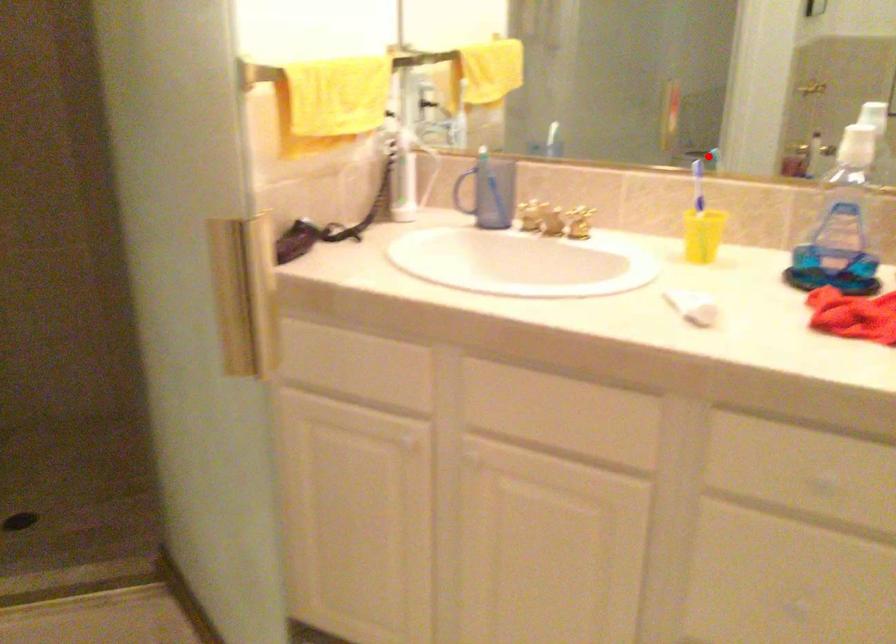
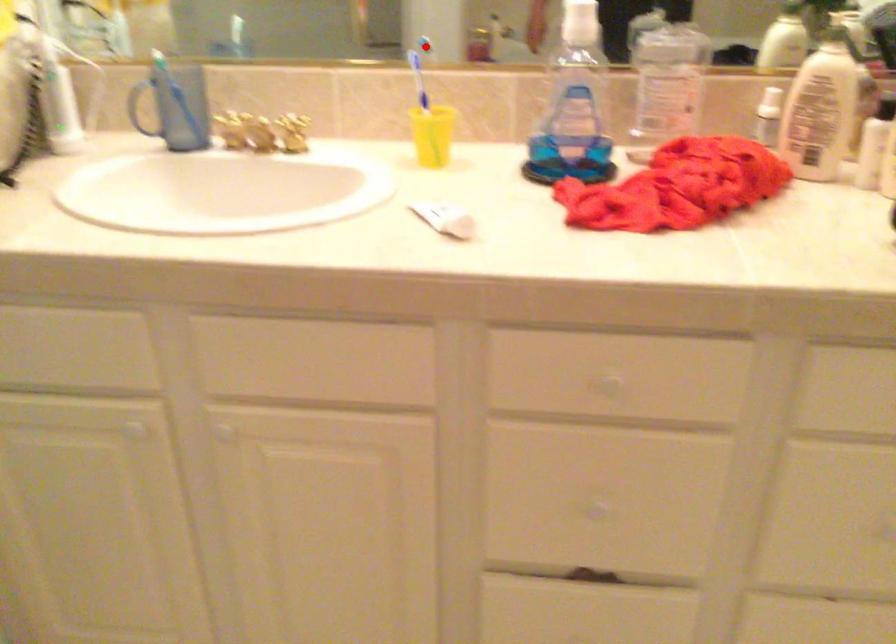
I am providing you with two images of the same scene from different viewpoints. A red point is marked on the first image and another point is marked on the second image. Do the highlighted points in image1 and image2 indicate the same real-world spot?

Yes